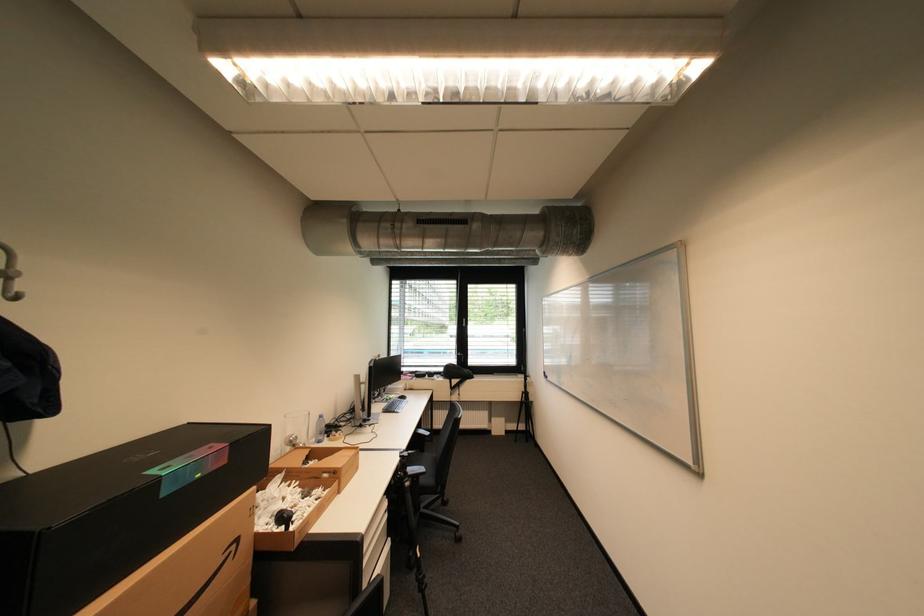
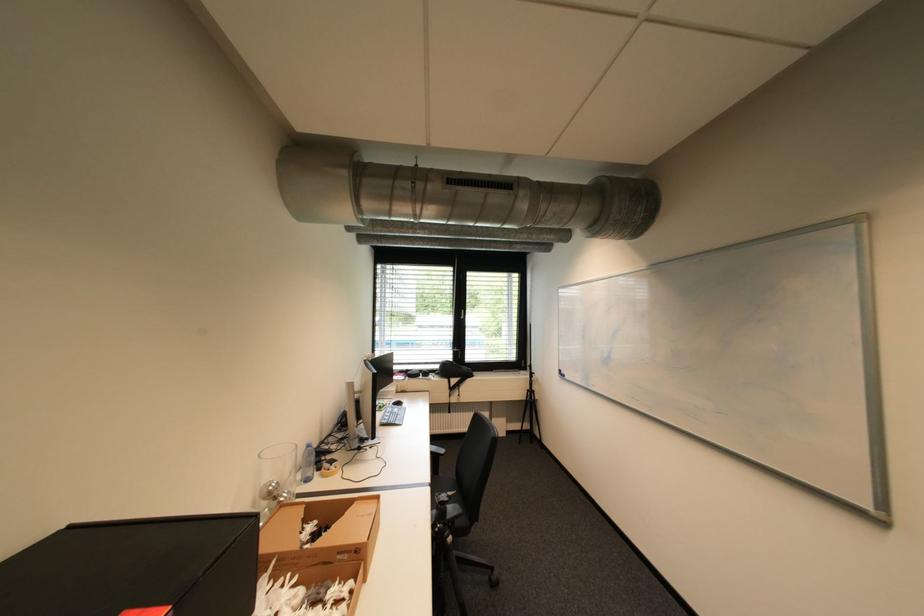
Question: The images are taken continuously from a first-person perspective. In which direction is your viewpoint rotating?

Choices:
 (A) Left
 (B) Right
 (C) Up
 (D) Down

Answer: (B)